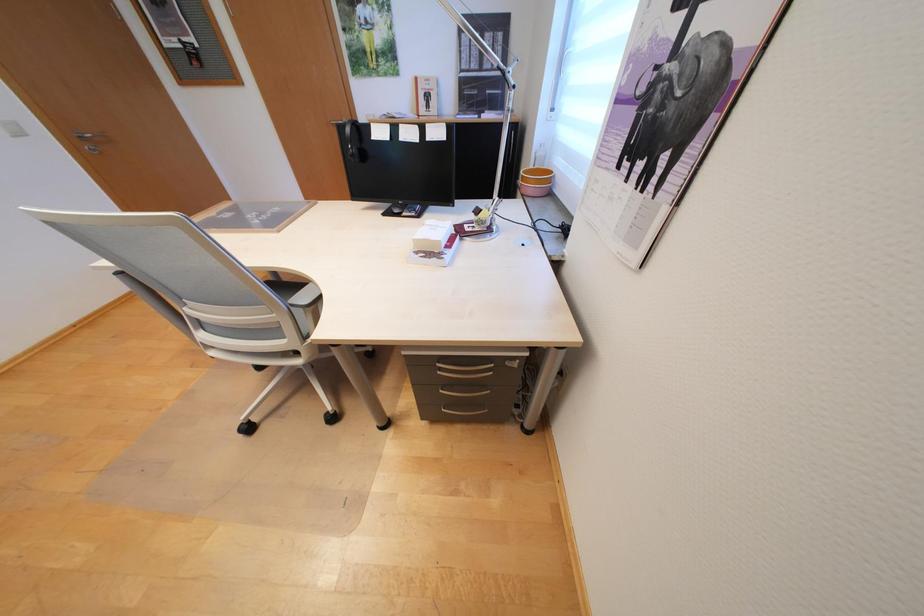
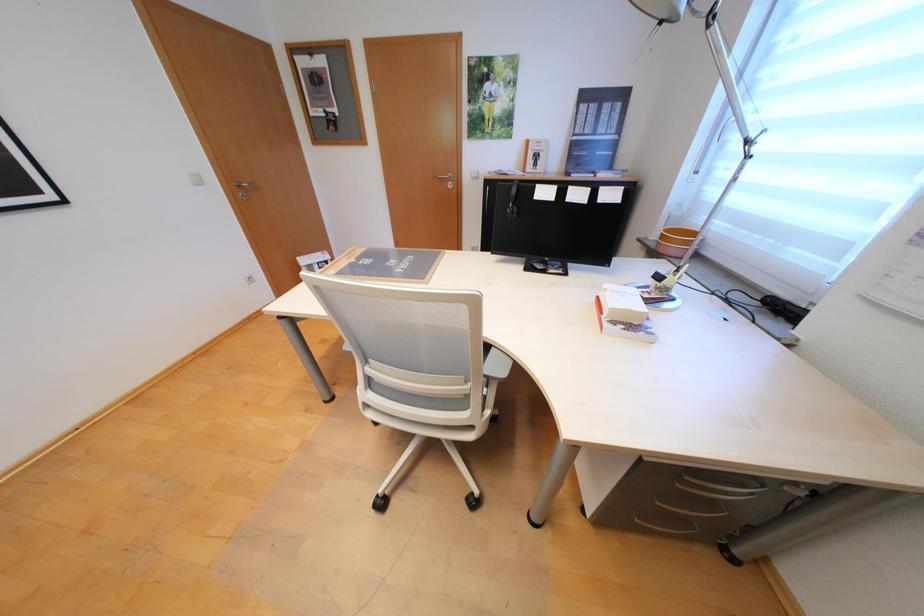
Question: The first image is from the beginning of the video and the second image is from the end. How did the camera likely rotate when shooting the video?

Choices:
 (A) Left
 (B) Right
 (C) Up
 (D) Down

Answer: (C)